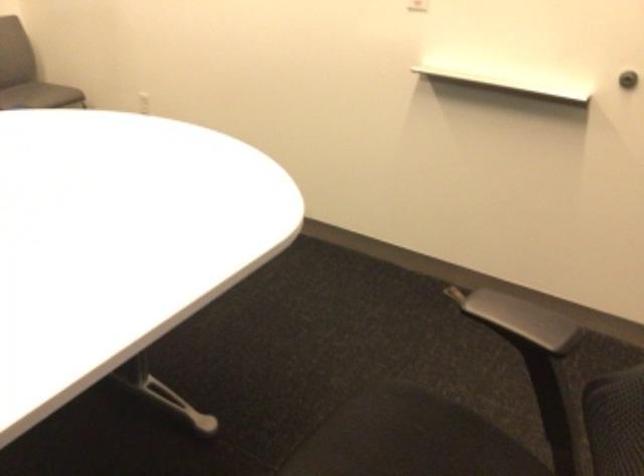
Identify the location of black chair armrest. Image resolution: width=644 pixels, height=476 pixels. (518, 317).